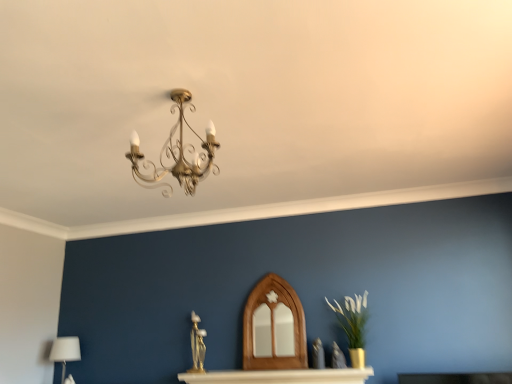
Question: From a real-world perspective, is white glossy table at center above or below gold metallic chandelier at upper center?

Choices:
 (A) below
 (B) above

Answer: (A)

Question: Considering the positions of white glossy table at center and gold metallic chandelier at upper center in the image, is white glossy table at center bigger or smaller than gold metallic chandelier at upper center?

Choices:
 (A) small
 (B) big

Answer: (A)

Question: Based on their relative distances, which object is nearer to the white glossy table at center?

Choices:
 (A) white fabric lampshade at lower left
 (B) gold metallic chandelier at upper center
 (C) green matte vase at right

Answer: (C)

Question: Considering the real-world distances, which object is closest to the green matte vase at right?

Choices:
 (A) gold metallic chandelier at upper center
 (B) white glossy table at center
 (C) white fabric lampshade at lower left

Answer: (B)